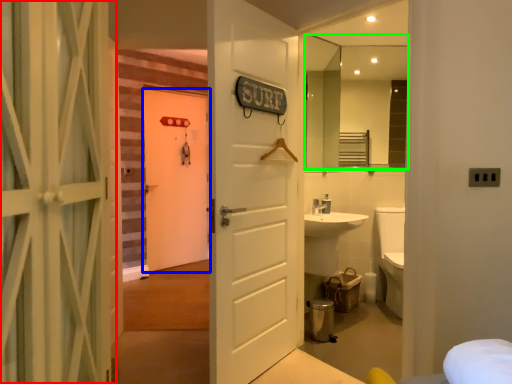
Question: Based on their relative distances, which object is nearer to door (highlighted by a red box)? Choose from door (highlighted by a blue box) and mirror (highlighted by a green box).

Choices:
 (A) door
 (B) mirror

Answer: (B)